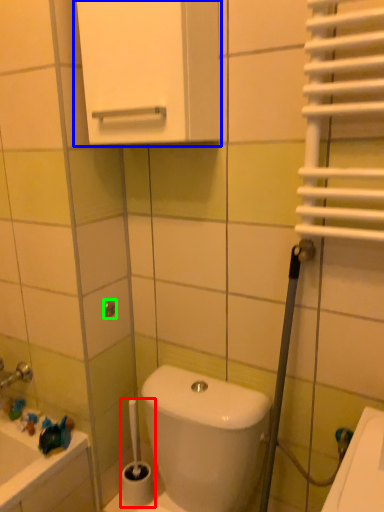
Question: Based on their relative distances, which object is nearer to brush (highlighted by a red box)? Choose from medicine cabinet (highlighted by a blue box) and shower (highlighted by a green box).

Choices:
 (A) medicine cabinet
 (B) shower

Answer: (B)